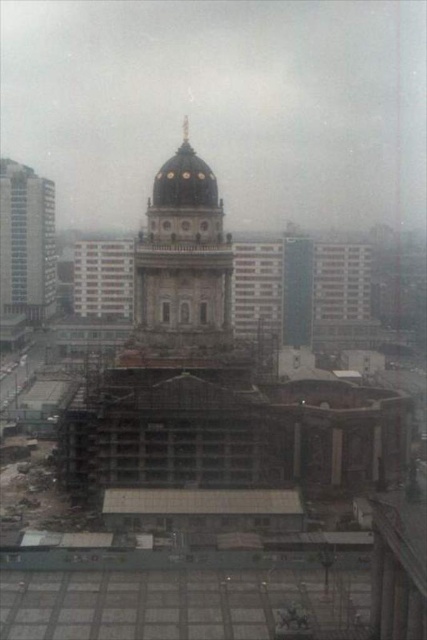
You are an architect evaluating the urban landscape. You notice the blue glass skyscraper at left and the white glass windows at left. Which of these two has a greater width?

The white glass windows at left have a greater width than the blue glass skyscraper at left.

You are an architect evaluating the building heights in the city. You observe the dark gray stone dome at center and the blue glass skyscraper at left. Which structure has a greater height?

The blue glass skyscraper at left is taller than the dark gray stone dome at center according to the description.

You are an architect inspecting the building. You notice a point at coordinates [183,259]. What architectural feature is located at this point?

The point at coordinates [183,259] is where the dark gray stone dome at center is located.